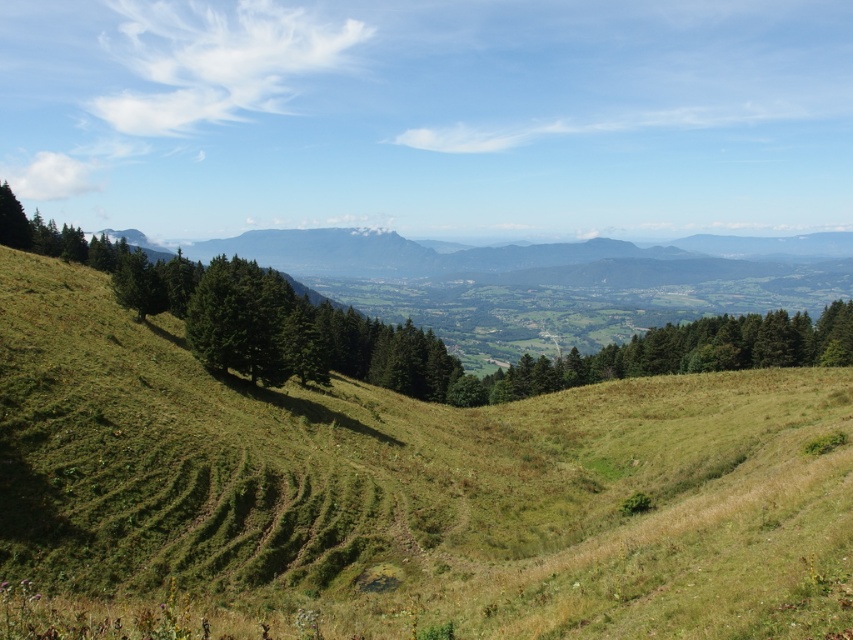
You are standing at the point labeled as point (410, 488) in the image. Looking around, what type of terrain or surface are you currently standing on?

You are standing on the green grassy hillside at center.

You are a hiker planning to walk from the green matte tree at left to the green grassy hillside at center. Given that your average walking pace is 3 feet per second, how many seconds will it take you to reach the hillside?

The green grassy hillside at center is 129.82 feet from the green matte tree at left. At a walking pace of 3 feet per second, dividing the distance by the speed gives approximately 43.27 seconds. Rounding to the nearest whole number, it would take about 43 seconds to reach the hillside.